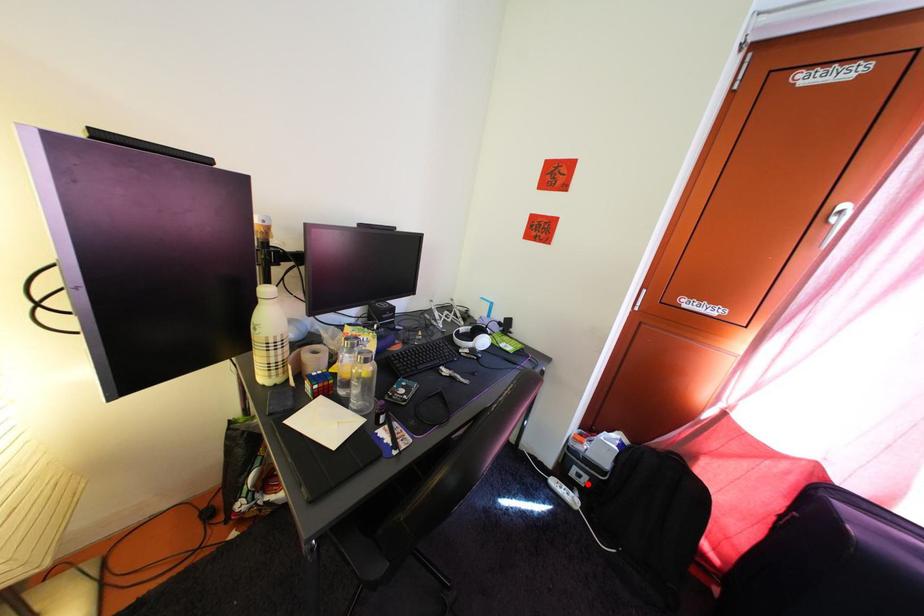
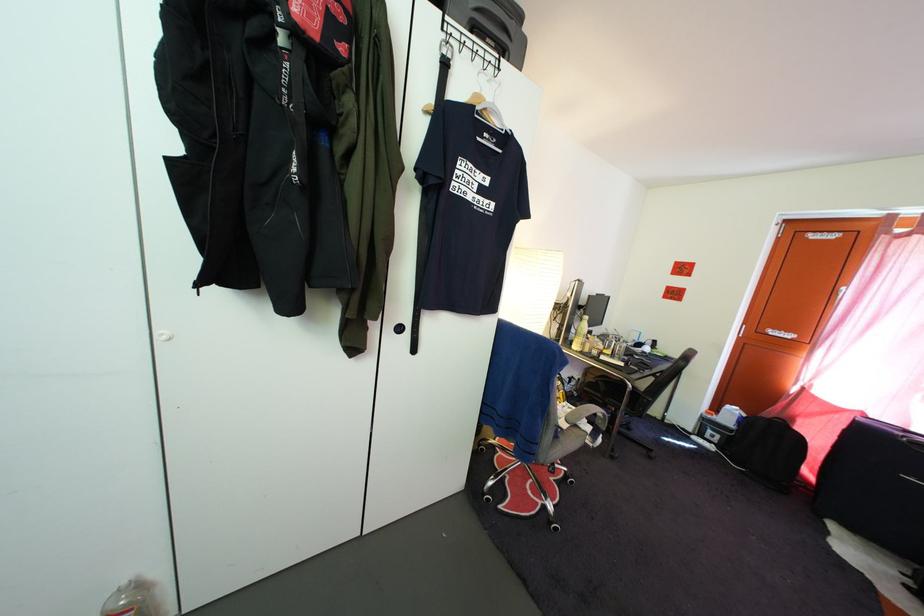
Locate, in the second image, the point that corresponds to the highlighted location in the first image.

(721, 445)